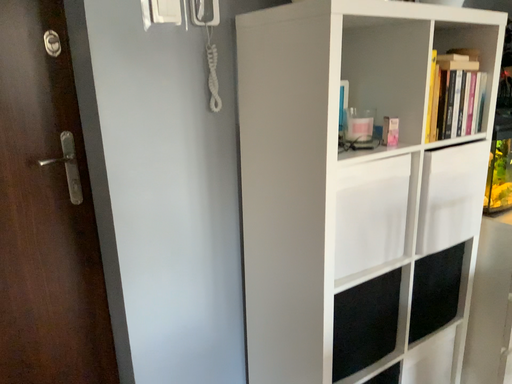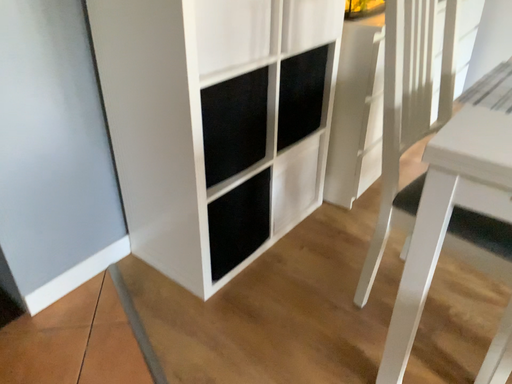
Question: Which way did the camera rotate in the video?

Choices:
 (A) rotated downward
 (B) rotated upward

Answer: (A)